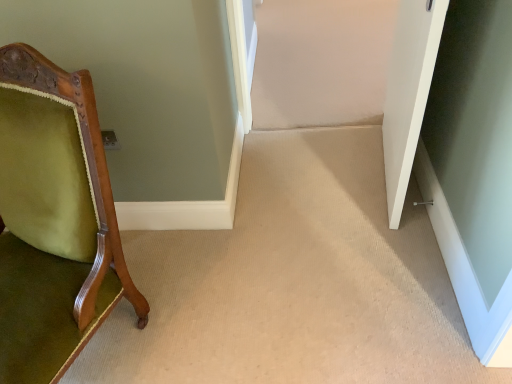
Question: Considering the relative positions of clear glass door at lower right and green velvet chair at left in the image provided, is clear glass door at lower right to the left of green velvet chair at left from the viewer's perspective?

Choices:
 (A) yes
 (B) no

Answer: (B)

Question: From the image's perspective, is clear glass door at lower right located above green velvet chair at left?

Choices:
 (A) no
 (B) yes

Answer: (A)

Question: Is clear glass door at lower right outside of green velvet chair at left?

Choices:
 (A) yes
 (B) no

Answer: (A)

Question: From a real-world perspective, is clear glass door at lower right on green velvet chair at left?

Choices:
 (A) no
 (B) yes

Answer: (A)

Question: Does clear glass door at lower right have a lesser height compared to green velvet chair at left?

Choices:
 (A) yes
 (B) no

Answer: (A)

Question: Can you confirm if clear glass door at lower right is taller than green velvet chair at left?

Choices:
 (A) no
 (B) yes

Answer: (A)

Question: Is the position of green velvet chair at left less distant than that of white matte door at right?

Choices:
 (A) yes
 (B) no

Answer: (A)

Question: From the image's perspective, is green velvet chair at left on top of white matte door at right?

Choices:
 (A) yes
 (B) no

Answer: (B)

Question: From the image's perspective, is green velvet chair at left under white matte door at right?

Choices:
 (A) yes
 (B) no

Answer: (A)

Question: Is green velvet chair at left further to camera compared to white matte door at right?

Choices:
 (A) no
 (B) yes

Answer: (A)

Question: Can you confirm if green velvet chair at left is thinner than white matte door at right?

Choices:
 (A) no
 (B) yes

Answer: (A)

Question: Could white matte door at right be considered to be inside green velvet chair at left?

Choices:
 (A) no
 (B) yes

Answer: (A)

Question: From a real-world perspective, is green velvet chair at left located higher than clear glass door at lower right?

Choices:
 (A) yes
 (B) no

Answer: (A)